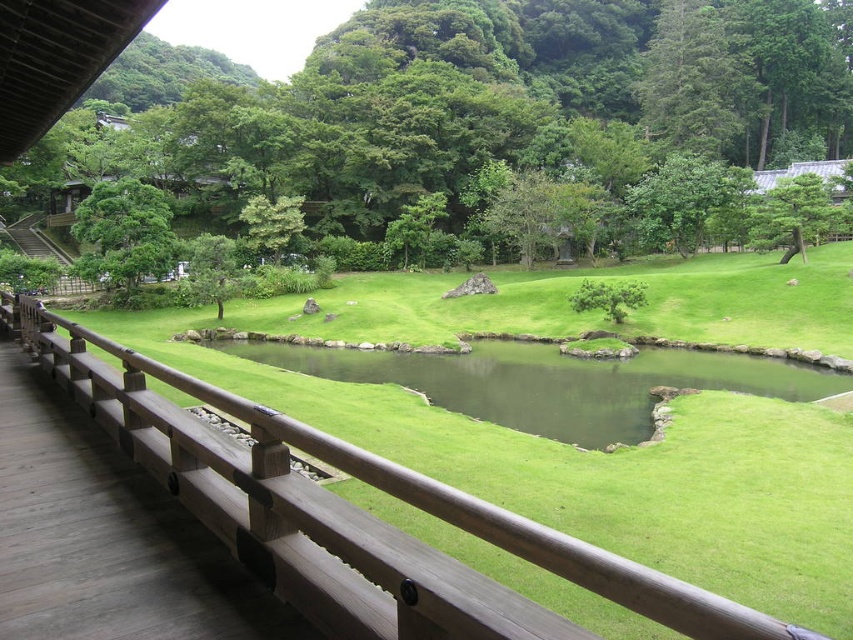
You are a gardener standing on the wooden railing and want to observe the green leafy tree at center and the green water at center. Which object is positioned higher from your viewpoint?

The green leafy tree at center is located above the green water at center, so it is positioned higher from your viewpoint.

You are a visitor standing on the wooden railing in the garden. You want to walk to the green water at center. Is the green leafy tree at center blocking your path?

The green leafy tree at center is 192.55 feet away from the green water at center. Since you are on the wooden railing, you would need to walk around the tree to reach the green water at center, but the distance between them doesn not indicate obstruction. However, without knowing the tree s size or path layout, it s unclear if the tree itself blocks the path. The given information only specifies their separation distance.

You are standing on the wooden railing and want to walk to the green textured pine tree at upper right. Which direction should you head relative to the green leafy tree at center?

You should head to the right of the green leafy tree at center because the green textured pine tree at upper right is located to the right side of it.